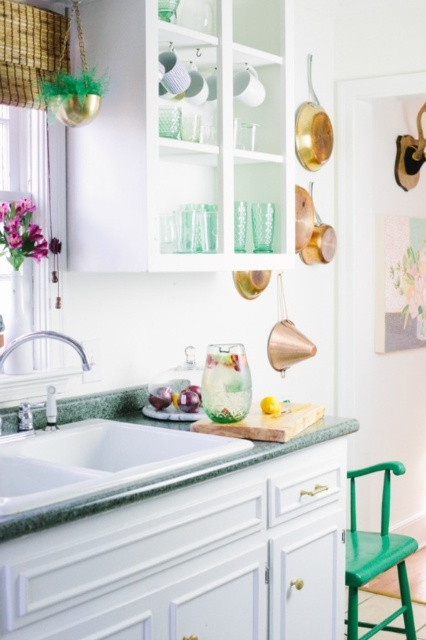
You are standing in the kitchen and want to reach a point that is 3 meters away from you. Is the point at coordinates point (389, 484) within that range?

The distance of point (389, 484) from camera is 2.83 meters, so yes, the point is within 3 meters range.

You are a kitchen designer assessing two faucets in the scene. Which faucet, the brushed metal faucet at lower left or the satin nickel faucet at sink left, would you recommend for a client who prefers a more substantial, visually prominent faucet?

The brushed metal faucet at lower left has a larger size compared to the satin nickel faucet at sink left, so it would be the better choice for a client wanting a more substantial and visually prominent faucet.